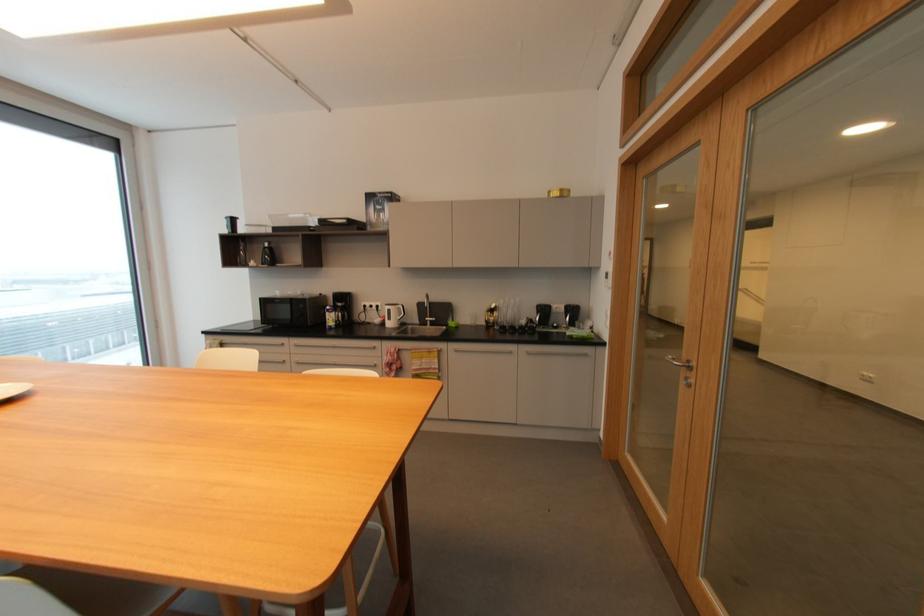
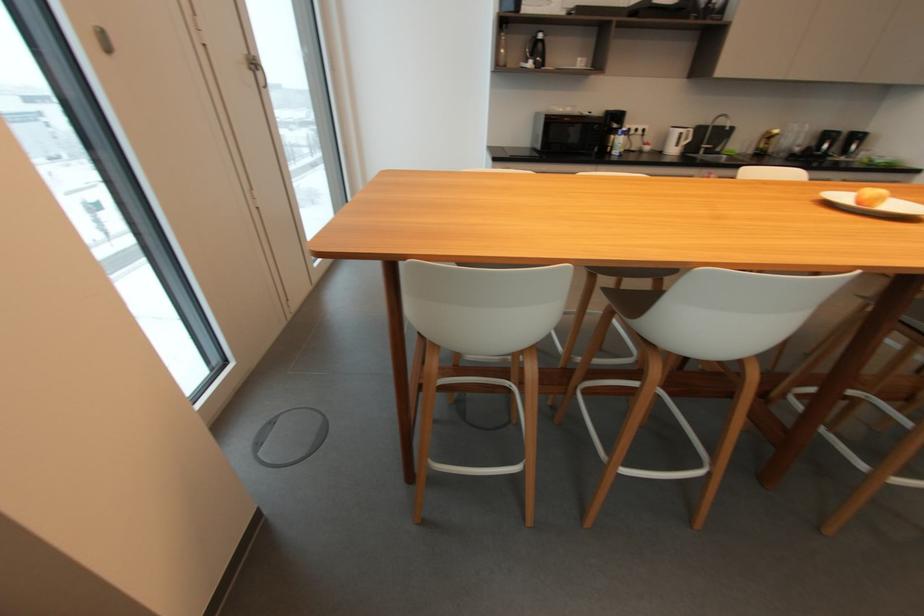
Find the pixel in the second image that matches pixel 271 245 in the first image.

(544, 36)